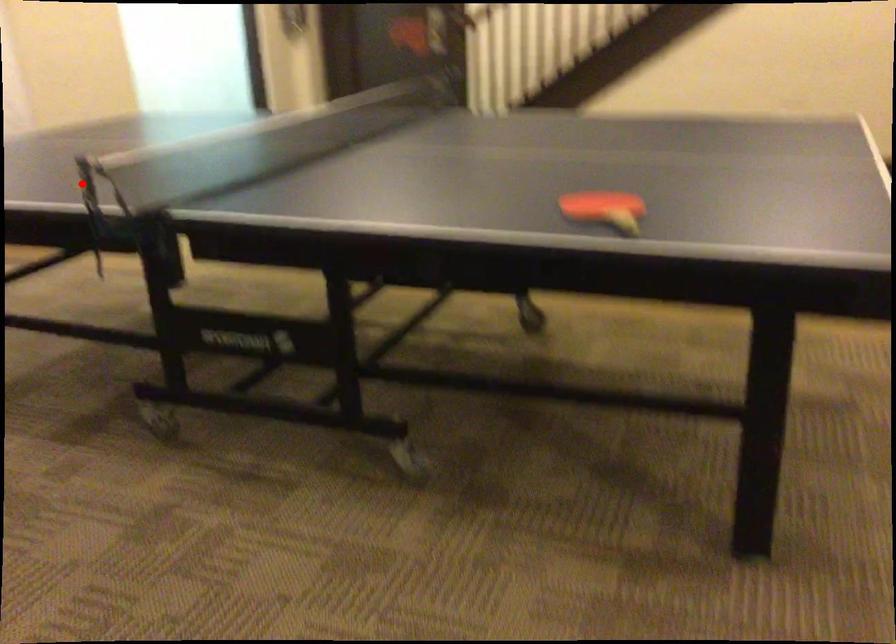
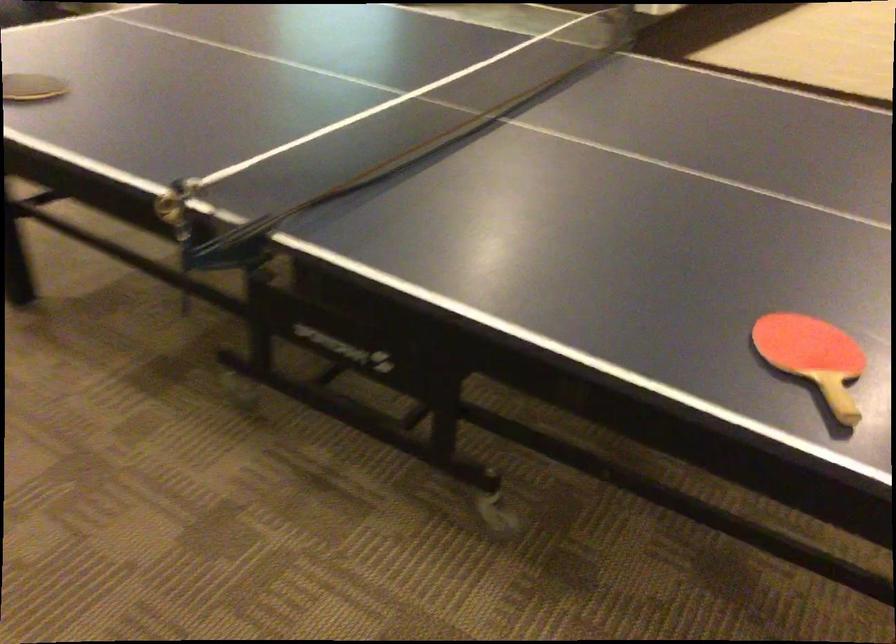
In the second image, find the point that corresponds to the highlighted location in the first image.

(174, 207)